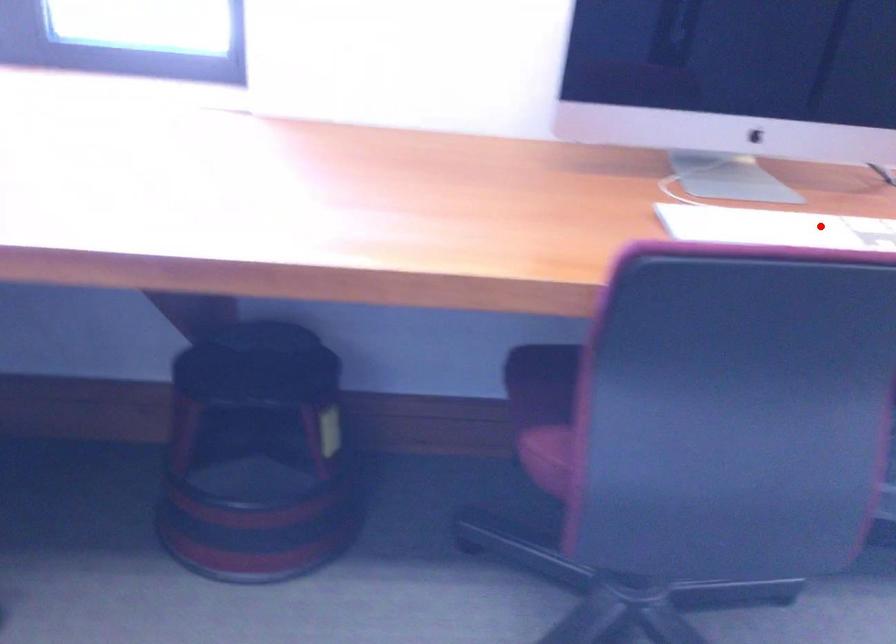
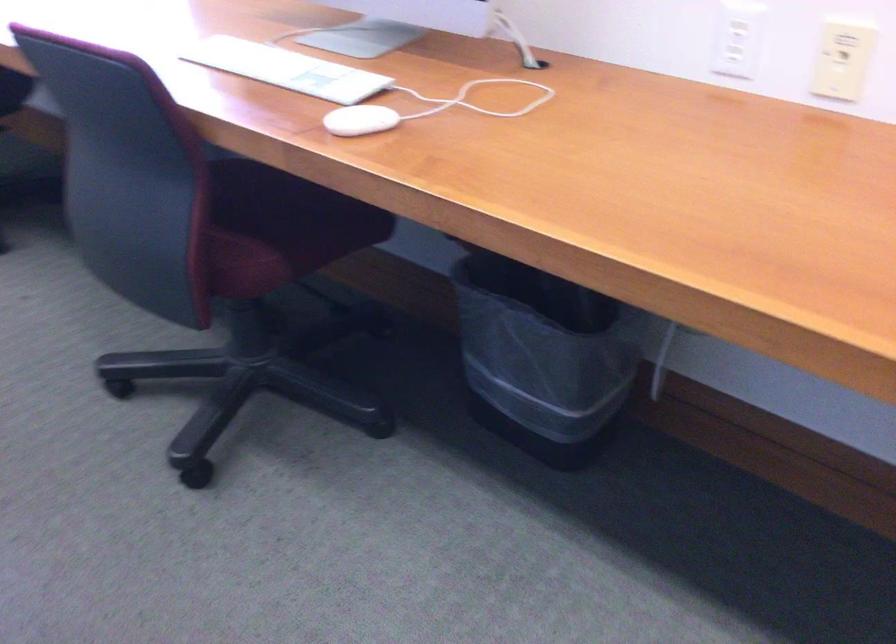
Question: A red point is marked in image1. In image2, is the corresponding 3D point closer to the camera or farther? Reply with the corresponding letter.

Choices:
 (A) The corresponding 3D point is closer.
 (B) The corresponding 3D point is farther.

Answer: (B)